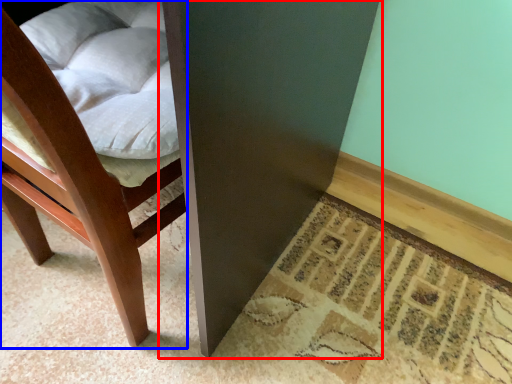
Question: Among these objects, which one is farthest to the camera, table (highlighted by a red box) or chair (highlighted by a blue box)?

Choices:
 (A) table
 (B) chair

Answer: (A)